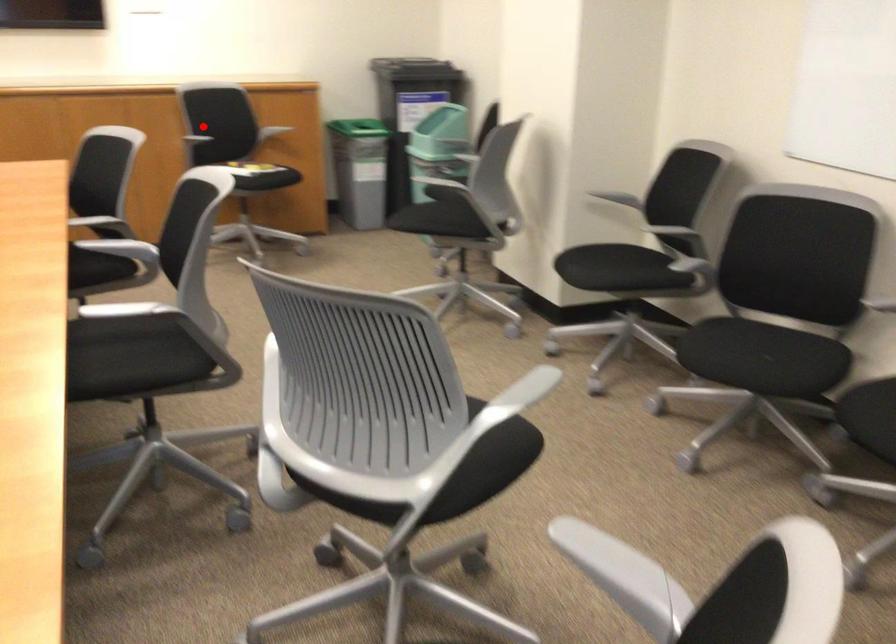
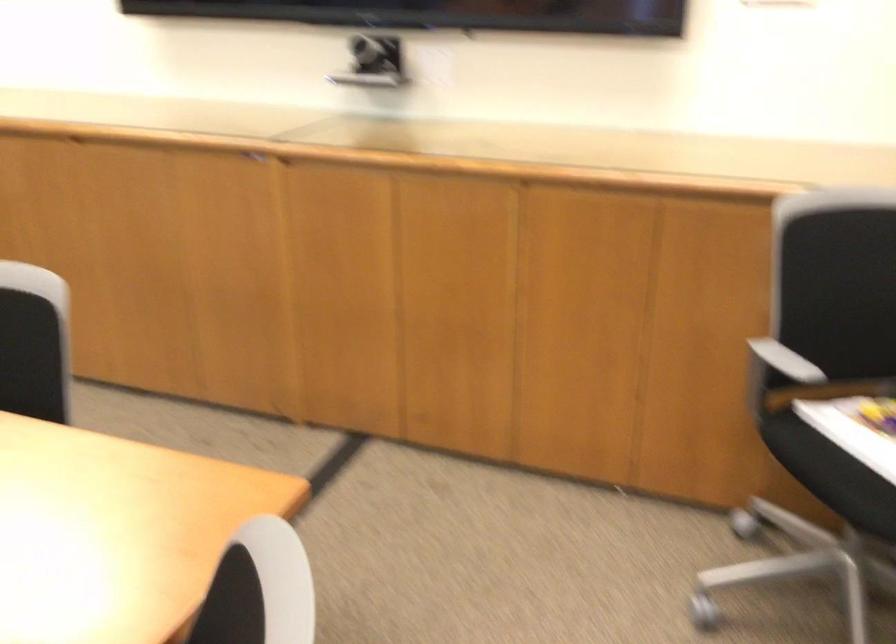
Question: I am providing you with two images of the same scene from different viewpoints. Given a red point in image1, look at the same physical point in image2. Is it:

Choices:
 (A) Closer to the viewpoint
 (B) Farther from the viewpoint

Answer: (A)